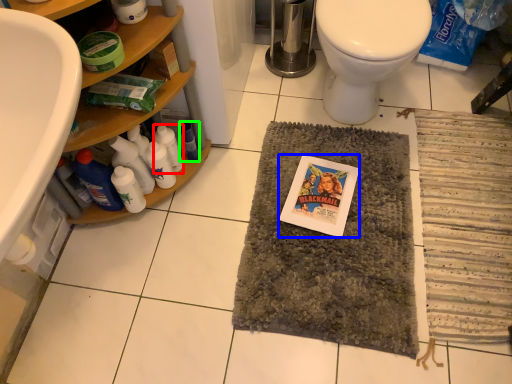
Question: Considering the real-world distances, which object is closest to bottle (highlighted by a red box)? comic book (highlighted by a blue box) or bottle (highlighted by a green box).

Choices:
 (A) comic book
 (B) bottle

Answer: (B)